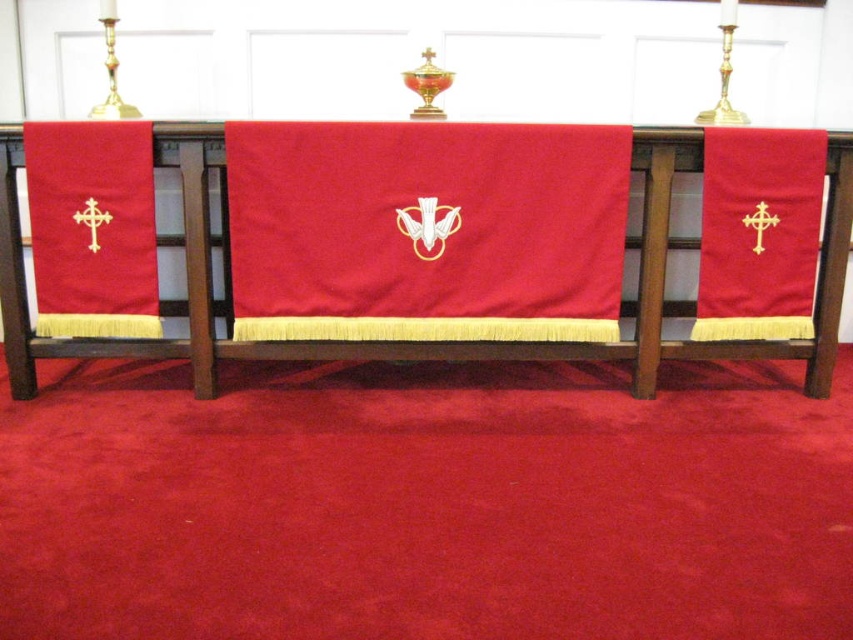
Question: Which of these objects is positioned farthest from the matte red fabric cross at left?

Choices:
 (A) matte red cloth at center
 (B) matte gold cross at right

Answer: (B)

Question: Among these objects, which one is farthest from the camera?

Choices:
 (A) matte red cloth at center
 (B) matte red fabric cross at left
 (C) matte gold cross at right

Answer: (C)

Question: Can you confirm if matte red cloth at center is wider than matte gold cross at right?

Choices:
 (A) no
 (B) yes

Answer: (B)

Question: Estimate the real-world distances between objects in this image. Which object is closer to the matte red cloth at center?

Choices:
 (A) matte gold cross at right
 (B) matte red fabric cross at left

Answer: (B)

Question: Is matte red fabric cross at left bigger than matte gold cross at right?

Choices:
 (A) no
 (B) yes

Answer: (B)

Question: Does matte red cloth at center have a greater width compared to matte gold cross at right?

Choices:
 (A) no
 (B) yes

Answer: (B)